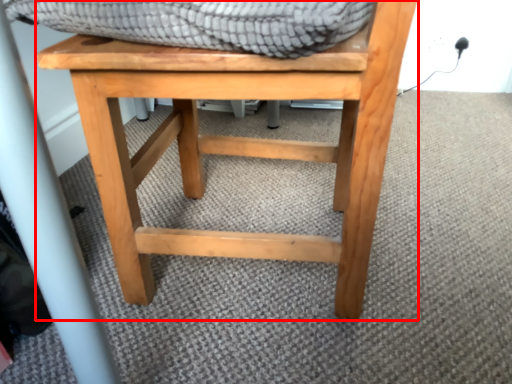
Question: In this image, where is stool (annotated by the red box) located relative to blanket?

Choices:
 (A) left
 (B) right

Answer: (A)